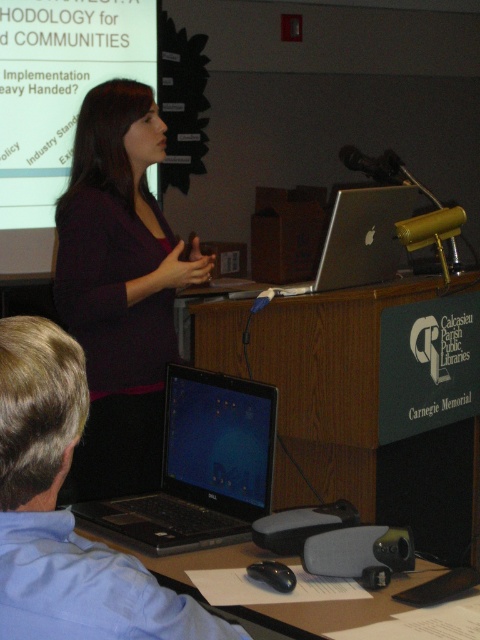
Question: Is blue glossy laptop at center further to the viewer compared to black plastic table at lower left?

Choices:
 (A) no
 (B) yes

Answer: (B)

Question: Which point is farther from the camera taking this photo?

Choices:
 (A) (399, 186)
 (B) (141, 428)

Answer: (A)

Question: Which is farther from the blue glossy laptop at center?

Choices:
 (A) black plastic table at center
 (B) matte purple shirt at center
 (C) black plastic table at lower left
 (D) white matte projection screen at upper left

Answer: (D)

Question: Can you confirm if matte purple shirt at center is positioned to the right of blue glossy laptop at center?

Choices:
 (A) yes
 (B) no

Answer: (B)

Question: Where is black plastic table at center located in relation to blue glossy laptop at center in the image?

Choices:
 (A) left
 (B) right

Answer: (B)

Question: Which object is the farthest from the black plastic table at center?

Choices:
 (A) white matte projection screen at upper left
 (B) black plastic table at lower left

Answer: (A)